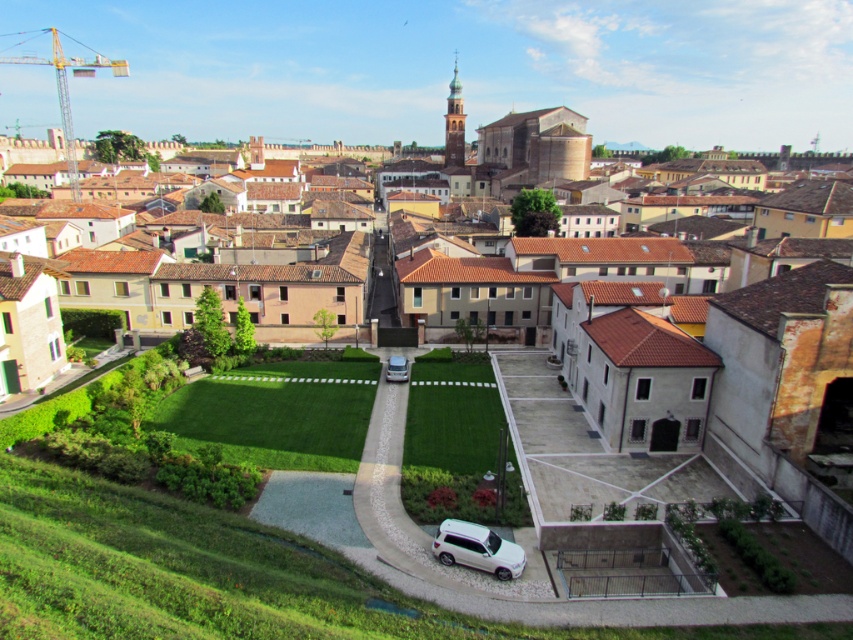
Question: Considering the relative positions of white matte car at lower center and silver metallic car at center in the image provided, where is white matte car at lower center located with respect to silver metallic car at center?

Choices:
 (A) left
 (B) right

Answer: (B)

Question: Where is white matte car at lower center located in relation to silver metallic car at center in the image?

Choices:
 (A) above
 (B) below

Answer: (B)

Question: Which point is closer to the camera?

Choices:
 (A) (402, 356)
 (B) (444, 525)

Answer: (B)

Question: Which point appears closest to the camera in this image?

Choices:
 (A) (502, 547)
 (B) (405, 372)

Answer: (A)

Question: Can you confirm if white matte car at lower center is smaller than silver metallic car at center?

Choices:
 (A) no
 (B) yes

Answer: (A)